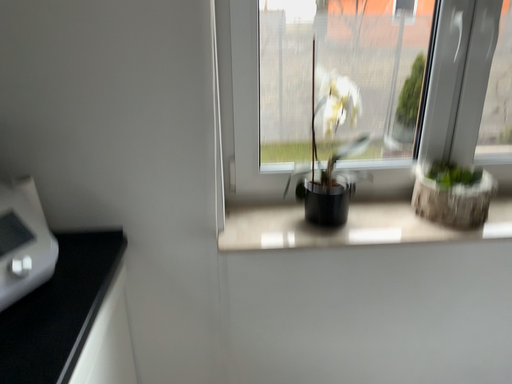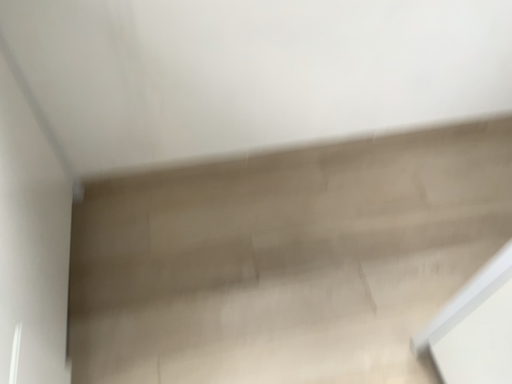
Question: How did the camera likely rotate when shooting the video?

Choices:
 (A) rotated downward
 (B) rotated upward

Answer: (A)